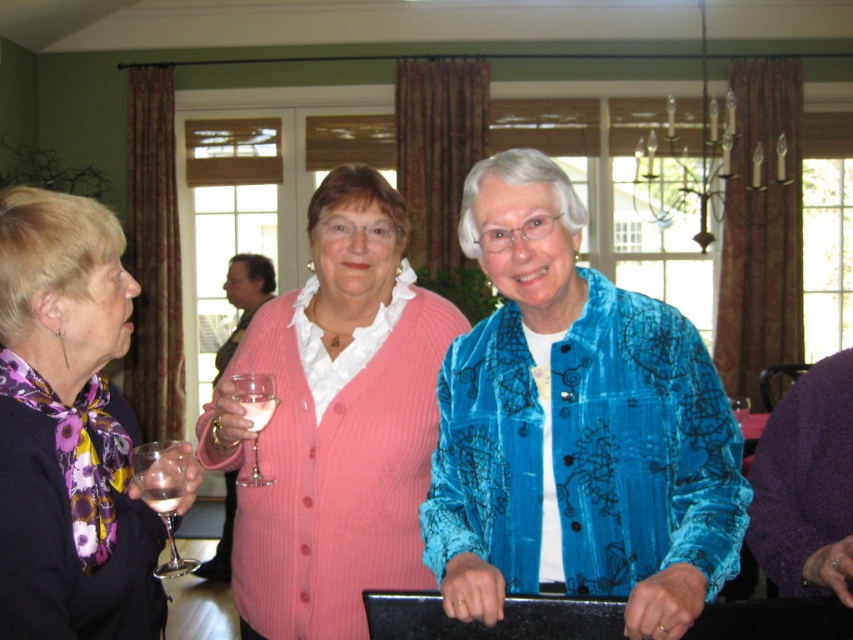
You are standing in the dining room and want to reach a point that is 5.11 feet away from you. Can you confirm if the point at coordinates point (x=270, y=406) is exactly that distance away?

The point (x=270, y=406) is exactly 5.11 feet away from the viewer, so yes, the point at coordinates point 0.637, (x=270, y=406) is exactly 5.11 feet away.

Looking at this image, you are standing at the position of point (x=270, y=381) and want to walk towards the exit located at point (x=352, y=422). Is there a clear path between these two points?

Point (x=352, y=422) is behind point (x=270, y=381), so there is a clear path between them.

You are a bartender at the event and need to place a coaster between the clear glass wine glass at center and the clear glass wine at center to prevent spills. Is there enough space to place the coaster between them?

The clear glass wine glass at center is 2.37 inches from the clear glass wine at center, so there is sufficient space to place a coaster between them as 2.37 inches is more than the typical coaster diameter of 4 inches.